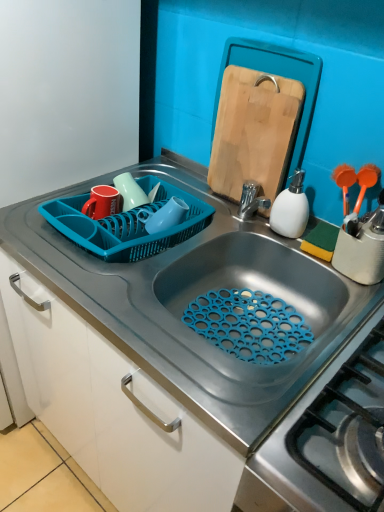
Identify the location of white matte soap dispenser at right. The width and height of the screenshot is (384, 512). (291, 209).

Find the location of a particular element. teal plastic dish rack at upper left is located at coordinates (126, 224).

What do you see at coordinates (129, 192) in the screenshot? I see `matte ceramic mugs at upper center, which appears as the first tableware when viewed from the right` at bounding box center [129, 192].

The width and height of the screenshot is (384, 512). Find the location of `white matte soap dispenser at right`. white matte soap dispenser at right is located at coordinates (291, 209).

Is white matte soap dispenser at right aimed at wooden cutting board at upper right?

No, white matte soap dispenser at right does not turn towards wooden cutting board at upper right.

Which of these two, white matte soap dispenser at right or wooden cutting board at upper right, stands taller?

Standing taller between the two is wooden cutting board at upper right.

From the image's perspective, is white matte soap dispenser at right located beneath wooden cutting board at upper right?

Yes, from the image's perspective, white matte soap dispenser at right is below wooden cutting board at upper right.

Is white matte soap dispenser at right beside wooden cutting board at upper right?

No.

Considering the relative positions of teal plastic dish rack at upper left and smooth gray countertop at center in the image provided, is teal plastic dish rack at upper left in front of smooth gray countertop at center?

That is False.

In the scene shown: Are teal plastic dish rack at upper left and smooth gray countertop at center far apart?

They are positioned close to each other.

Consider the image. Is teal plastic dish rack at upper left at the left side of smooth gray countertop at center?

Correct, you'll find teal plastic dish rack at upper left to the left of smooth gray countertop at center.

Based on their sizes in the image, would you say teal plastic dish rack at upper left is bigger or smaller than smooth gray countertop at center?

Clearly, teal plastic dish rack at upper left is smaller in size than smooth gray countertop at center.

Can you tell me how much matte red mug at upper left, acting as the first tableware starting from the left, and matte ceramic mugs at upper center, which appears as the first tableware when viewed from the right, differ in facing direction?

There is a 0.00298-degree angle between the facing directions of matte red mug at upper left, acting as the first tableware starting from the left, and matte ceramic mugs at upper center, which appears as the first tableware when viewed from the right.

In order to click on tableware that is on the right side of matte red mug at upper left, acting as the first tableware starting from the left in this screenshot , I will do `click(129, 192)`.

Considering the sizes of matte red mug at upper left, acting as the first tableware starting from the left, and matte ceramic mugs at upper center, placed as the second tableware when sorted from left to right, in the image, is matte red mug at upper left, acting as the first tableware starting from the left, wider or thinner than matte ceramic mugs at upper center, placed as the second tableware when sorted from left to right,?

In the image, matte red mug at upper left, acting as the first tableware starting from the left, appears to be wider than matte ceramic mugs at upper center, placed as the second tableware when sorted from left to right.

Who is shorter, wooden cutting board at upper right or teal plastic dish rack at upper left?

teal plastic dish rack at upper left.

From a real-world perspective, is wooden cutting board at upper right positioned under teal plastic dish rack at upper left based on gravity?

No, from a real-world perspective, wooden cutting board at upper right is not beneath teal plastic dish rack at upper left.

Considering the positions of point (229, 83) and point (168, 191), is point (229, 83) closer or farther from the camera than point (168, 191)?

Point (229, 83) is closer to the camera than point (168, 191).

Who is more distant, matte ceramic mugs at upper center, placed as the second tableware when sorted from left to right, or wooden cutting board at upper right?

matte ceramic mugs at upper center, placed as the second tableware when sorted from left to right, is more distant.

From the image's perspective, which is above, matte ceramic mugs at upper center, which appears as the first tableware when viewed from the right, or wooden cutting board at upper right?

From the image's view, wooden cutting board at upper right is above.

Between matte ceramic mugs at upper center, which appears as the first tableware when viewed from the right, and wooden cutting board at upper right, which one appears on the left side from the viewer's perspective?

matte ceramic mugs at upper center, which appears as the first tableware when viewed from the right, is more to the left.

Is matte ceramic mugs at upper center, which appears as the first tableware when viewed from the right, turned away from wooden cutting board at upper right?

No, wooden cutting board at upper right is not at the back of matte ceramic mugs at upper center, which appears as the first tableware when viewed from the right.

Would you say white matte soap dispenser at right is outside matte ceramic mugs at upper center, which appears as the first tableware when viewed from the right?

white matte soap dispenser at right lies outside matte ceramic mugs at upper center, which appears as the first tableware when viewed from the right,'s area.

Considering the sizes of white matte soap dispenser at right and matte ceramic mugs at upper center, which appears as the first tableware when viewed from the right, in the image, is white matte soap dispenser at right taller or shorter than matte ceramic mugs at upper center, which appears as the first tableware when viewed from the right,?

Clearly, white matte soap dispenser at right is taller compared to matte ceramic mugs at upper center, which appears as the first tableware when viewed from the right.

Is white matte soap dispenser at right aimed at matte ceramic mugs at upper center, which appears as the first tableware when viewed from the right?

No, white matte soap dispenser at right is not turned towards matte ceramic mugs at upper center, which appears as the first tableware when viewed from the right.

From the image's perspective, does wooden cutting board at upper right appear higher than matte red mug at upper left, the 2th tableware positioned from the right?

Yes, from the image's perspective, wooden cutting board at upper right is over matte red mug at upper left, the 2th tableware positioned from the right.

From a real-world perspective, is wooden cutting board at upper right positioned above or below matte red mug at upper left, the 2th tableware positioned from the right?

In terms of real-world spatial position, wooden cutting board at upper right is above matte red mug at upper left, the 2th tableware positioned from the right.

Considering the sizes of objects wooden cutting board at upper right and matte red mug at upper left, the 2th tableware positioned from the right, in the image provided, who is thinner, wooden cutting board at upper right or matte red mug at upper left, the 2th tableware positioned from the right,?

wooden cutting board at upper right is thinner.

Could you tell me if wooden cutting board at upper right is facing matte red mug at upper left, the 2th tableware positioned from the right?

No, wooden cutting board at upper right does not turn towards matte red mug at upper left, the 2th tableware positioned from the right.

Image resolution: width=384 pixels, height=512 pixels. I want to click on appliance located below the wooden cutting board at upper right (from the image's perspective), so click(x=291, y=209).

You are a GUI agent. You are given a task and a screenshot of the screen. Output one action in this format:
    pyautogui.click(x=<x>, y=<y>)
    Task: Click on the countertop beneath the teal plastic dish rack at upper left (from a real-world perspective)
    The height and width of the screenshot is (512, 384).
    Given the screenshot: What is the action you would take?
    pyautogui.click(x=172, y=354)

From the image, which object appears to be nearer to matte red mug at upper left, acting as the first tableware starting from the left, wooden cutting board at upper right or white matte soap dispenser at right?

Based on the image, wooden cutting board at upper right appears to be nearer to matte red mug at upper left, acting as the first tableware starting from the left.

Estimate the real-world distances between objects in this image. Which object is closer to wooden cutting board at upper right, matte red mug at upper left, acting as the first tableware starting from the left, or smooth gray countertop at center?

Based on the image, matte red mug at upper left, acting as the first tableware starting from the left, appears to be nearer to wooden cutting board at upper right.

When comparing their distances from teal plastic dish rack at upper left, does white matte soap dispenser at right or wooden cutting board at upper right seem closer?

wooden cutting board at upper right is positioned closer to the anchor teal plastic dish rack at upper left.

Based on their spatial positions, is wooden cutting board at upper right or white matte soap dispenser at right closer to smooth gray countertop at center?

wooden cutting board at upper right lies closer to smooth gray countertop at center than the other object.

From the picture: Based on their spatial positions, is wooden cutting board at upper right or white matte soap dispenser at right closer to teal plastic dish rack at upper left?

Based on the image, wooden cutting board at upper right appears to be nearer to teal plastic dish rack at upper left.

Which object lies further to the anchor point wooden cutting board at upper right, smooth gray countertop at center or white matte soap dispenser at right?

smooth gray countertop at center.

Which object lies nearer to the anchor point smooth gray countertop at center, white matte soap dispenser at right or wooden cutting board at upper right?

wooden cutting board at upper right lies closer to smooth gray countertop at center than the other object.

Which object lies nearer to the anchor point matte ceramic mugs at upper center, placed as the second tableware when sorted from left to right, white matte soap dispenser at right or wooden cutting board at upper right?

wooden cutting board at upper right is positioned closer to the anchor matte ceramic mugs at upper center, placed as the second tableware when sorted from left to right.

Where is `appliance between wooden cutting board at upper right and smooth gray countertop at center in the vertical direction`? The image size is (384, 512). appliance between wooden cutting board at upper right and smooth gray countertop at center in the vertical direction is located at coordinates (291, 209).

This screenshot has width=384, height=512. In order to click on basket situated between matte red mug at upper left, the 2th tableware positioned from the right, and white matte soap dispenser at right from left to right in this screenshot , I will do pos(126,224).

The height and width of the screenshot is (512, 384). I want to click on basket between matte ceramic mugs at upper center, placed as the second tableware when sorted from left to right, and white matte soap dispenser at right, so click(x=126, y=224).

Image resolution: width=384 pixels, height=512 pixels. I want to click on tableware positioned between teal plastic dish rack at upper left and matte ceramic mugs at upper center, which appears as the first tableware when viewed from the right, from near to far, so click(x=102, y=202).